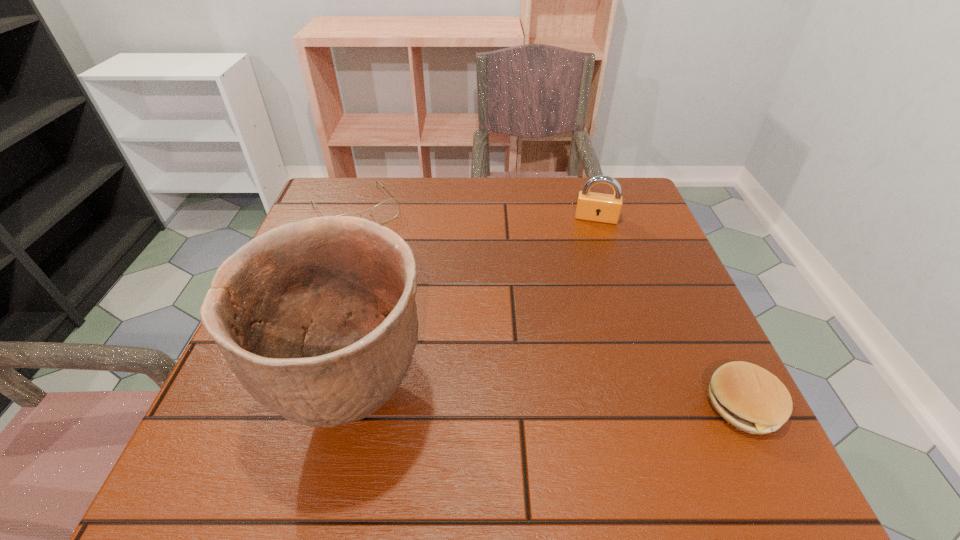
The height and width of the screenshot is (540, 960). I want to click on free location that satisfies the following two spatial constraints: 1. on the front side of the spectacles; 2. on the left side of the tallest object, so click(x=289, y=397).

The image size is (960, 540). What are the coordinates of `vacant space that satisfies the following two spatial constraints: 1. on the back side of the tallest object; 2. on the left side of the padlock` in the screenshot? It's located at (396, 218).

The width and height of the screenshot is (960, 540). What are the coordinates of `free point that satisfies the following two spatial constraints: 1. on the front side of the rightmost object; 2. on the left side of the third object from left to right` in the screenshot? It's located at (658, 405).

This screenshot has width=960, height=540. In order to click on blank area in the image that satisfies the following two spatial constraints: 1. on the front side of the padlock; 2. on the right side of the spectacles in this screenshot , I will do `click(353, 218)`.